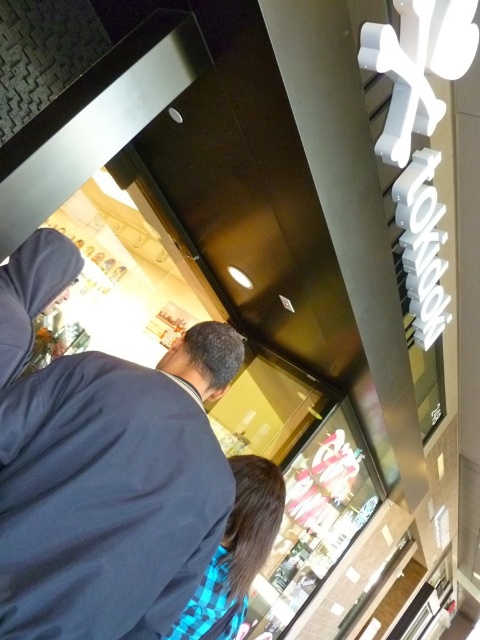
From the picture: Does dark blue fabric at center appear over blue plaid shirt at lower center?

Indeed, dark blue fabric at center is positioned over blue plaid shirt at lower center.

Can you confirm if dark blue fabric at center is wider than blue plaid shirt at lower center?

Indeed, dark blue fabric at center has a greater width compared to blue plaid shirt at lower center.

Is point (36, 508) positioned before point (230, 561)?

That is True.

Find the location of a particular element. dark blue fabric at center is located at coordinates (111, 490).